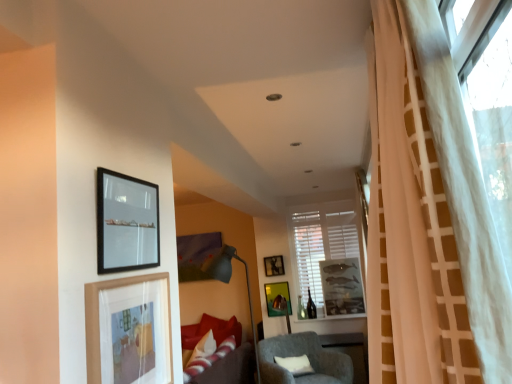
Question: From a real-world perspective, is matte gray floor lamp at center under metallic gold picture frame at center, which is the second picture frame in back-to-front order?

Choices:
 (A) no
 (B) yes

Answer: (A)

Question: Is matte gray floor lamp at center looking in the opposite direction of metallic gold picture frame at center, the 4th picture frame from the front?

Choices:
 (A) yes
 (B) no

Answer: (B)

Question: Is matte gray floor lamp at center to the right of metallic gold picture frame at center, which is the second picture frame from right to left, from the viewer's perspective?

Choices:
 (A) no
 (B) yes

Answer: (A)

Question: Does matte gray floor lamp at center lie in front of metallic gold picture frame at center, the 4th picture frame from the front?

Choices:
 (A) no
 (B) yes

Answer: (B)

Question: Is matte gray floor lamp at center oriented towards metallic gold picture frame at center, which appears as the fourth picture frame when viewed from the left?

Choices:
 (A) yes
 (B) no

Answer: (B)

Question: Looking at their shapes, would you say wooden picture frame at lower left, acting as the 1th picture frame starting from the front, is wider or thinner than white sheer curtain at right?

Choices:
 (A) thin
 (B) wide

Answer: (A)

Question: From a real-world perspective, is wooden picture frame at lower left, the second picture frame in the left-to-right sequence, positioned above or below white sheer curtain at right?

Choices:
 (A) below
 (B) above

Answer: (A)

Question: Relative to white sheer curtain at right, is wooden picture frame at lower left, the second picture frame in the left-to-right sequence, in front or behind?

Choices:
 (A) behind
 (B) front

Answer: (A)

Question: Considering the relative positions of wooden picture frame at lower left, the second picture frame in the left-to-right sequence, and white sheer curtain at right in the image provided, is wooden picture frame at lower left, the second picture frame in the left-to-right sequence, to the left or to the right of white sheer curtain at right?

Choices:
 (A) right
 (B) left

Answer: (B)

Question: Considering their positions, is matte gray floor lamp at center located in front of or behind black matte picture frame at upper left, marked as the 1th picture frame in a left-to-right arrangement?

Choices:
 (A) behind
 (B) front

Answer: (A)

Question: In terms of width, does matte gray floor lamp at center look wider or thinner when compared to black matte picture frame at upper left, which is the 2th picture frame from front to back?

Choices:
 (A) thin
 (B) wide

Answer: (B)

Question: Considering the relative positions of matte gray floor lamp at center and black matte picture frame at upper left, marked as the 1th picture frame in a left-to-right arrangement, in the image provided, is matte gray floor lamp at center to the left or to the right of black matte picture frame at upper left, marked as the 1th picture frame in a left-to-right arrangement,?

Choices:
 (A) right
 (B) left

Answer: (A)

Question: In terms of height, does matte gray floor lamp at center look taller or shorter compared to black matte picture frame at upper left, which is the 2th picture frame from front to back?

Choices:
 (A) short
 (B) tall

Answer: (B)

Question: Considering the positions of white sheer curtain at right and matte gray floor lamp at center in the image, is white sheer curtain at right bigger or smaller than matte gray floor lamp at center?

Choices:
 (A) small
 (B) big

Answer: (B)

Question: From a real-world perspective, relative to matte gray floor lamp at center, is white sheer curtain at right vertically above or below?

Choices:
 (A) above
 (B) below

Answer: (A)